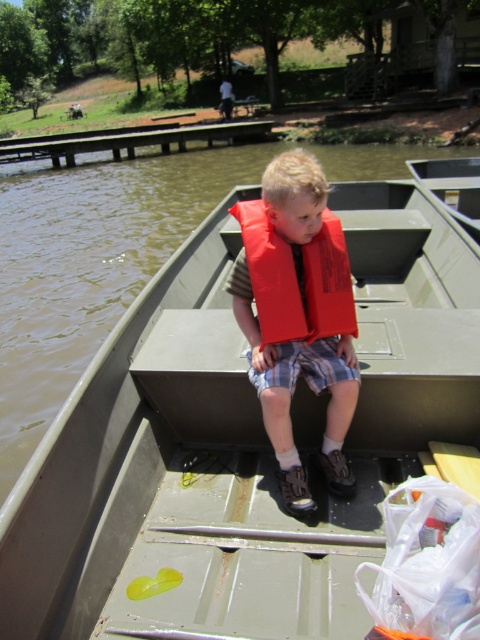
You are a photographer trying to capture the metallic gray boat at center and the matte orange life vest at center in a single shot. Since the boat is closer to you, will the life vest appear smaller in the photo compared to the boat?

Yes, the metallic gray boat at center is closer to the viewer than the matte orange life vest at center, so the life vest will appear smaller in the photo due to its distance from the camera.

What are the coordinates of the matte orange life vest at center?

The matte orange life vest at center is located at coordinates point (294, 317).

You are a safety inspector checking the boat for proper equipment. You notice two life preservers at the center of the boat. Which one is taller, the matte orange life vest at center or the red matte life jacket at center?

The matte orange life vest at center is taller than the red matte life jacket at center according to the description.